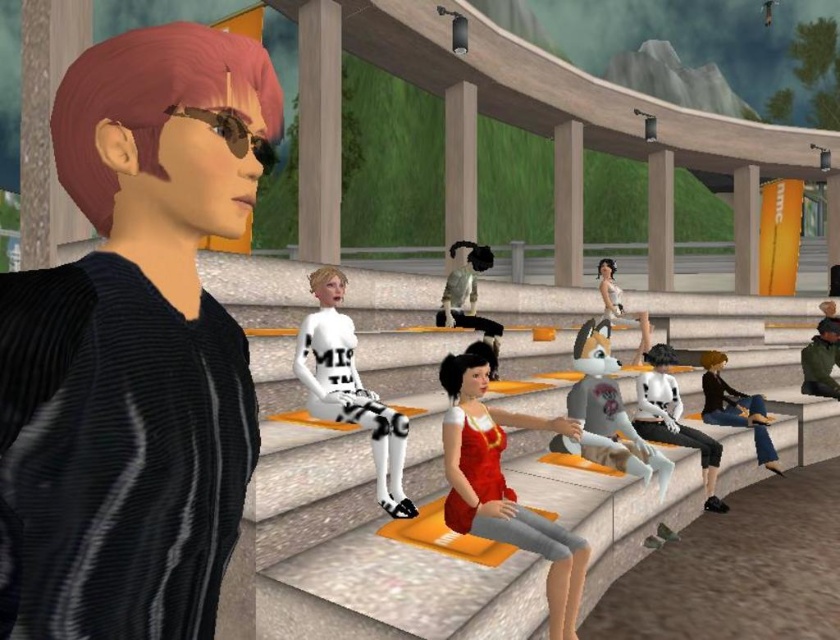
Who is more distant from viewer, (565,554) or (822,348)?

Point (822,348)

Is shiny red dress at center thinner than green matte jacket at right?

Yes, shiny red dress at center is thinner than green matte jacket at right.

Which is behind, point (444, 419) or point (827, 385)?

The point (827, 385) is more distant.

At what (x,y) coordinates should I click in order to perform the action: click on shiny red dress at center. Please return your answer as a coordinate pair (x, y). Image resolution: width=840 pixels, height=640 pixels. Looking at the image, I should click on click(504, 483).

Does white matte/soft fabric at center appear on the left side of black matte dog at center?

Yes, white matte/soft fabric at center is to the left of black matte dog at center.

Who is taller, white matte/soft fabric at center or black matte dog at center?

black matte dog at center

Who is more distant from viewer, [381,401] or [453,256]?

The point [453,256] is more distant.

At what (x,y) coordinates should I click in order to perform the action: click on white matte/soft fabric at center. Please return your answer as a coordinate pair (x, y). Looking at the image, I should click on (349, 387).

Can you confirm if white matte/soft fabric at center is taller than gray fabric dog at center?

Yes.

Where is `white matte/soft fabric at center`? The height and width of the screenshot is (640, 840). white matte/soft fabric at center is located at coordinates (349, 387).

The width and height of the screenshot is (840, 640). In order to click on white matte/soft fabric at center in this screenshot , I will do `click(349, 387)`.